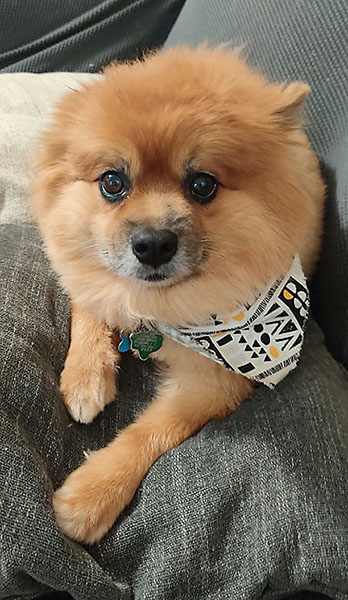
Where is `grey blanket`? The height and width of the screenshot is (600, 348). grey blanket is located at coordinates (199, 478).